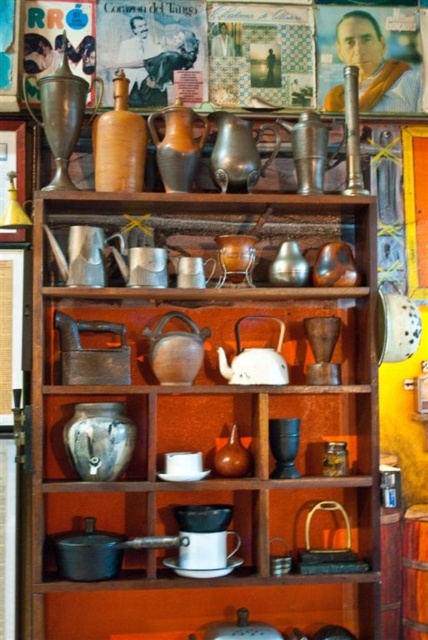
Question: Is brushed metal tea pot at left to the right of white matte teapot at center from the viewer's perspective?

Choices:
 (A) yes
 (B) no

Answer: (B)

Question: Can you confirm if matte ceramic teapot at center is positioned to the left of matte brown teapot at center?

Choices:
 (A) no
 (B) yes

Answer: (A)

Question: Which of the following is the closest to the observer?

Choices:
 (A) (157, 324)
 (B) (121, 259)

Answer: (B)

Question: Among these objects, which one is farthest from the camera?

Choices:
 (A) matte brown jar at center
 (B) matte brown teapot at center

Answer: (A)

Question: Among these objects, which one is farthest from the camera?

Choices:
 (A) matte ceramic teapot at center
 (B) shiny silver teapot at center
 (C) white matte teapot at center
 (D) matte brown jar at center

Answer: (D)

Question: Does shiny silver teapot at center appear on the left side of matte brown jar at center?

Choices:
 (A) no
 (B) yes

Answer: (B)